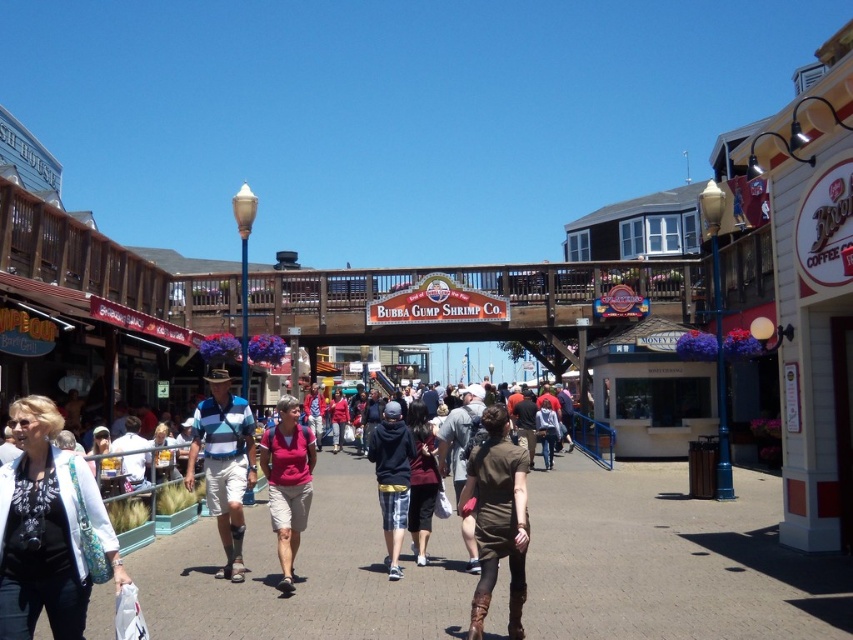
Which is above, striped polo shirt at center or pink fabric shirt at center?

Positioned higher is pink fabric shirt at center.

At what (x,y) coordinates should I click in order to perform the action: click on striped polo shirt at center. Please return your answer as a coordinate pair (x, y). Image resolution: width=853 pixels, height=640 pixels. Looking at the image, I should click on (224, 465).

Is point (508, 458) positioned before point (381, 470)?

Yes, it is in front of point (381, 470).

Who is shorter, brown matte dress at center or dark blue hoodie at center?

dark blue hoodie at center is shorter.

Who is more distant from viewer, (459, 506) or (396, 458)?

Positioned behind is point (396, 458).

Locate an element on the screen. The height and width of the screenshot is (640, 853). brown matte dress at center is located at coordinates (497, 518).

Is brown matte dress at center below pink fabric shirt at center?

Indeed, brown matte dress at center is positioned under pink fabric shirt at center.

Based on the photo, who is positioned more to the right, brown matte dress at center or pink fabric shirt at center?

Positioned to the right is brown matte dress at center.

The width and height of the screenshot is (853, 640). What do you see at coordinates (497, 518) in the screenshot?
I see `brown matte dress at center` at bounding box center [497, 518].

Where is `brown matte dress at center`? This screenshot has width=853, height=640. brown matte dress at center is located at coordinates (497, 518).